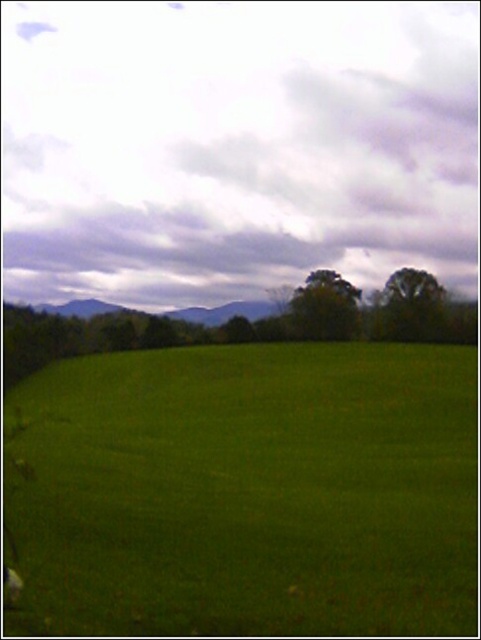
You are standing in the middle of the green grassy pasture at center and want to walk towards the green leafy tree at center. Which direction should you head to get closer to the tree?

Since the green grassy pasture at center is closer to you than the green leafy tree at center, you should walk forward towards the tree to get closer to it.

You are standing in a rural field with a vast expanse of green grass. There is a point marked at coordinates [40,388]. If you want to walk towards that point, how far will you have to walk in feet?

The point at [40,388] is 229.61 feet away from the viewer, so you will have to walk 229.61 feet to reach it.

You are standing in the middle of the field and see two points in the scene. The first point is at coordinate point (104, 362) and the second is at point (295, 301). Which point is closer to you?

Point (104, 362) is closer to the camera than point (295, 301), so the first point is closer to you.